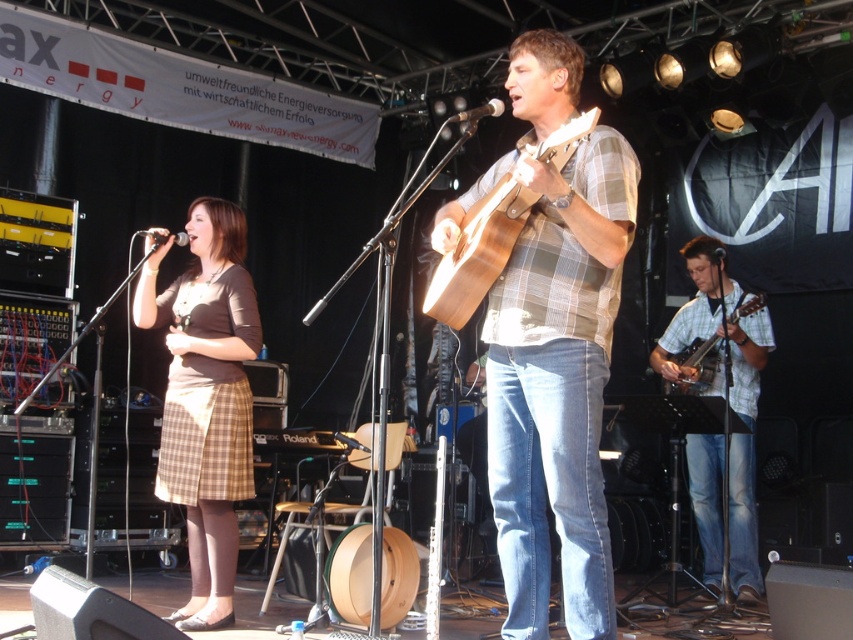
Question: Which point appears closest to the camera in this image?

Choices:
 (A) (154, 237)
 (B) (183, 339)
 (C) (567, 138)

Answer: (C)

Question: Among these points, which one is farthest from the camera?

Choices:
 (A) (723, 259)
 (B) (758, 380)
 (C) (165, 236)
 (D) (517, 464)

Answer: (B)

Question: Which of these objects is positioned farthest from the wooden acoustic guitar at right?

Choices:
 (A) metallic silver microphone at upper center
 (B) matte black microphone at center
 (C) brown plaid skirt at left
 (D) light blue plaid shirt at center

Answer: (B)

Question: Can you confirm if matte brown guitar at center is positioned to the right of brown plaid skirt at left?

Choices:
 (A) yes
 (B) no

Answer: (A)

Question: Does wooden acoustic guitar at center come behind metallic silver microphone at center?

Choices:
 (A) no
 (B) yes

Answer: (A)

Question: Can you confirm if light blue plaid shirt at center is thinner than matte black microphone at center?

Choices:
 (A) no
 (B) yes

Answer: (A)